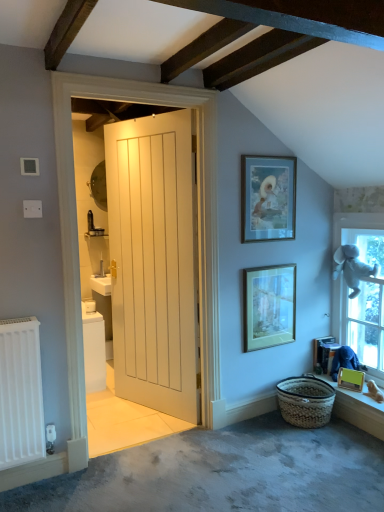
Question: Is matte yellow picture frame at lower right, the 3th picture frame in the top-to-bottom sequence, taller or shorter than wooden window sill at lower right?

Choices:
 (A) tall
 (B) short

Answer: (A)

Question: From the image's perspective, is matte yellow picture frame at lower right, the 3th picture frame in the top-to-bottom sequence, positioned above or below wooden window sill at lower right?

Choices:
 (A) below
 (B) above

Answer: (B)

Question: Which object is positioned farthest from the wooden window sill at lower right?

Choices:
 (A) white plush toy at right
 (B) matte glass picture frame at center, which is the 2th picture frame from right to left
 (C) braided straw basket at lower right
 (D) wooden changing table at lower right
 (E) matte gold picture frame at upper center, positioned as the third picture frame in right-to-left order

Answer: (E)

Question: Based on their relative distances, which object is nearer to the white plush toy at right?

Choices:
 (A) wooden window sill at lower right
 (B) braided straw basket at lower right
 (C) wooden changing table at lower right
 (D) matte glass picture frame at center, the second picture frame from the bottom
 (E) matte yellow picture frame at lower right, the 3th picture frame in the top-to-bottom sequence

Answer: (C)